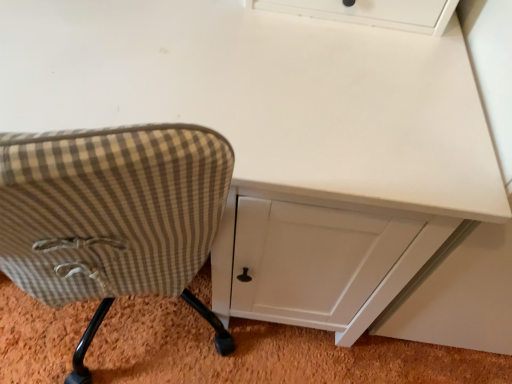
Identify the location of vacant space underneath brown checkered fabric chair at left (from a real-world perspective). The width and height of the screenshot is (512, 384). (124, 334).